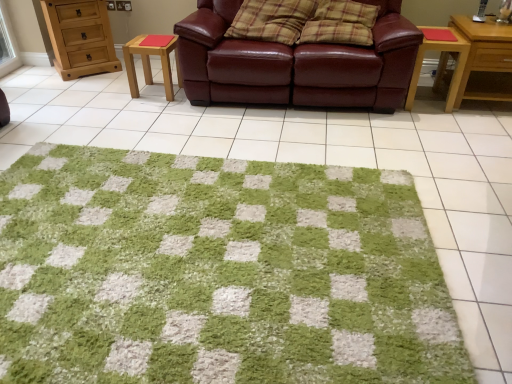
Question: Can you confirm if leather couch at center is wider than wooden stool at center-left, the first table positioned from the left?

Choices:
 (A) no
 (B) yes

Answer: (B)

Question: Is leather couch at center outside wooden stool at center-left, the 2th table from the right?

Choices:
 (A) yes
 (B) no

Answer: (A)

Question: Can you confirm if leather couch at center is bigger than wooden stool at center-left, the 2th table from the right?

Choices:
 (A) yes
 (B) no

Answer: (A)

Question: Is leather couch at center far away from wooden stool at center-left, the first table positioned from the left?

Choices:
 (A) yes
 (B) no

Answer: (B)

Question: Can wooden stool at center-left, the 2th table from the right, be found inside leather couch at center?

Choices:
 (A) yes
 (B) no

Answer: (B)

Question: Considering their positions, is light brown wooden chest of drawers at upper left located in front of or behind plaid fabric pillow at center, placed as the second pillow when sorted from right to left?

Choices:
 (A) front
 (B) behind

Answer: (B)

Question: Considering the positions of light brown wooden chest of drawers at upper left and plaid fabric pillow at center, placed as the second pillow when sorted from right to left, in the image, is light brown wooden chest of drawers at upper left taller or shorter than plaid fabric pillow at center, placed as the second pillow when sorted from right to left,?

Choices:
 (A) short
 (B) tall

Answer: (B)

Question: From a real-world perspective, is light brown wooden chest of drawers at upper left physically located above or below plaid fabric pillow at center, which is counted as the 1th pillow, starting from the left?

Choices:
 (A) above
 (B) below

Answer: (B)

Question: From the image's perspective, relative to plaid fabric pillow at center, placed as the second pillow when sorted from right to left, is light brown wooden chest of drawers at upper left above or below?

Choices:
 (A) below
 (B) above

Answer: (B)

Question: Considering the positions of plaid fabric pillow at center, the first pillow when ordered from right to left, and light brown wooden chest of drawers at upper left in the image, is plaid fabric pillow at center, the first pillow when ordered from right to left, taller or shorter than light brown wooden chest of drawers at upper left?

Choices:
 (A) short
 (B) tall

Answer: (A)

Question: Is plaid fabric pillow at center, the first pillow when ordered from right to left, in front of or behind light brown wooden chest of drawers at upper left in the image?

Choices:
 (A) front
 (B) behind

Answer: (A)

Question: From the image's perspective, relative to light brown wooden chest of drawers at upper left, is plaid fabric pillow at center, positioned as the 2th pillow in left-to-right order, above or below?

Choices:
 (A) above
 (B) below

Answer: (B)

Question: Choose the correct answer: Is plaid fabric pillow at center, the first pillow when ordered from right to left, inside light brown wooden chest of drawers at upper left or outside it?

Choices:
 (A) outside
 (B) inside

Answer: (A)

Question: From a real-world perspective, relative to green shaggy rug at center, is light brown wooden chest of drawers at upper left vertically above or below?

Choices:
 (A) above
 (B) below

Answer: (A)

Question: Which is correct: light brown wooden chest of drawers at upper left is inside green shaggy rug at center, or outside of it?

Choices:
 (A) inside
 (B) outside

Answer: (B)